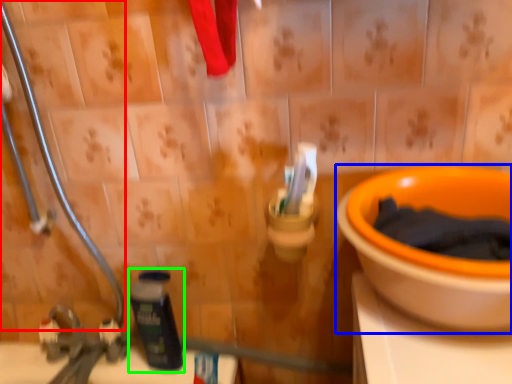
Question: Estimate the real-world distances between objects in this image. Which object is farther from pipe (highlighted by a red box), toilet (highlighted by a blue box) or bottle (highlighted by a green box)?

Choices:
 (A) toilet
 (B) bottle

Answer: (A)